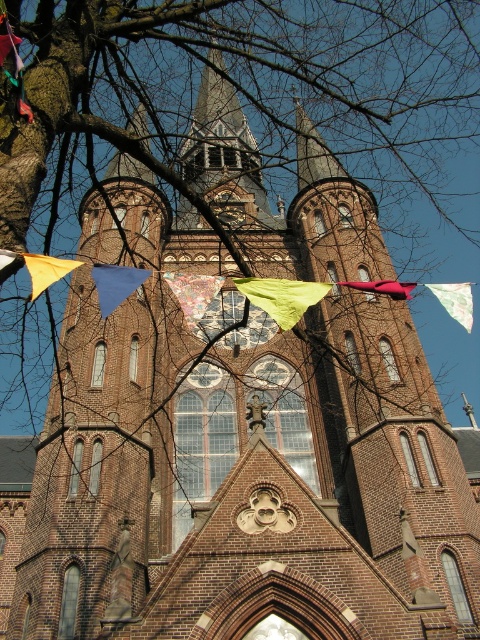
Can you confirm if green fabric flag at center is positioned below blue fabric flag at center?

No.

Is green fabric flag at center behind blue fabric flag at center?

No, it is not.

Is point (297, 298) in front of point (108, 314)?

No, it is behind (108, 314).

What are the coordinates of `green fabric flag at center` in the screenshot? It's located at (282, 296).

Which of these two, yellow fabric flag at center or matte red flag at center, stands shorter?

matte red flag at center

Measure the distance between point (38, 292) and camera.

Point (38, 292) and camera are 33.36 meters apart from each other.

I want to click on yellow fabric flag at center, so click(47, 269).

Which is more to the right, green fabric flag at center or matte red flag at center?

Positioned to the right is matte red flag at center.

In the scene shown: Is green fabric flag at center wider than matte red flag at center?

In fact, green fabric flag at center might be narrower than matte red flag at center.

What do you see at coordinates (282, 296) in the screenshot?
I see `green fabric flag at center` at bounding box center [282, 296].

Where is `green fabric flag at center`? Image resolution: width=480 pixels, height=640 pixels. green fabric flag at center is located at coordinates (282, 296).